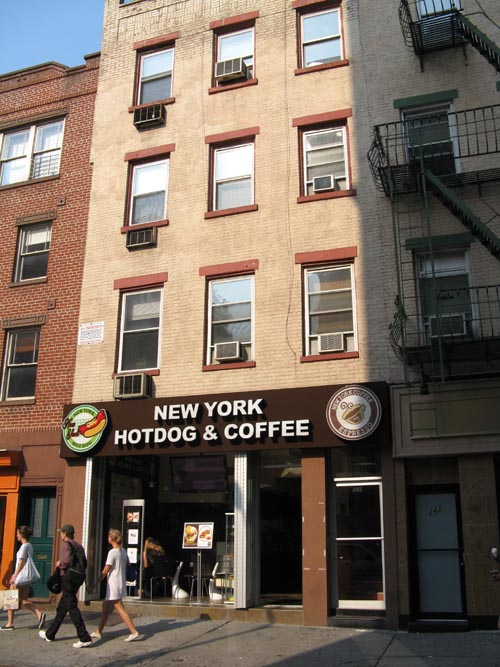
Identify the location of tall glass window on ground floor. (159, 496), (279, 528).